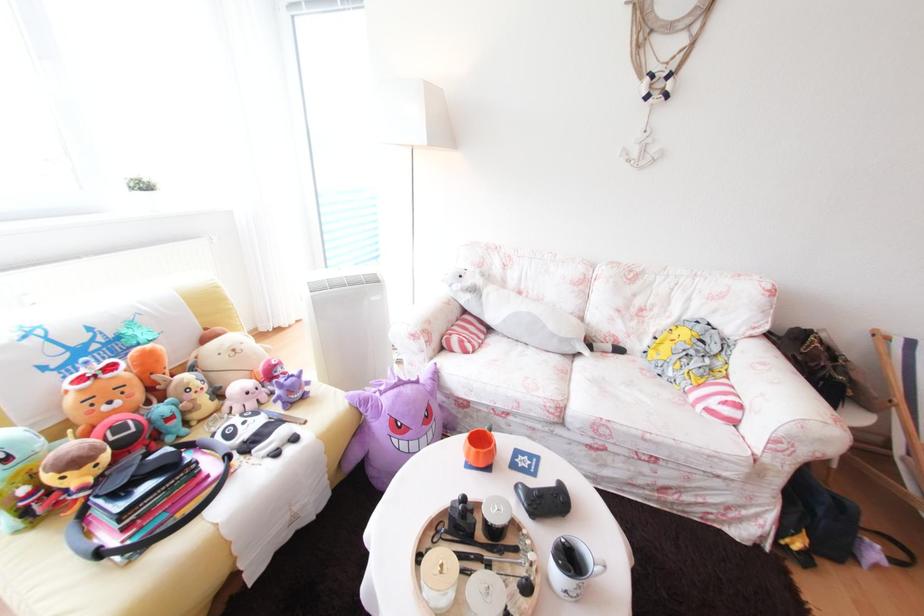
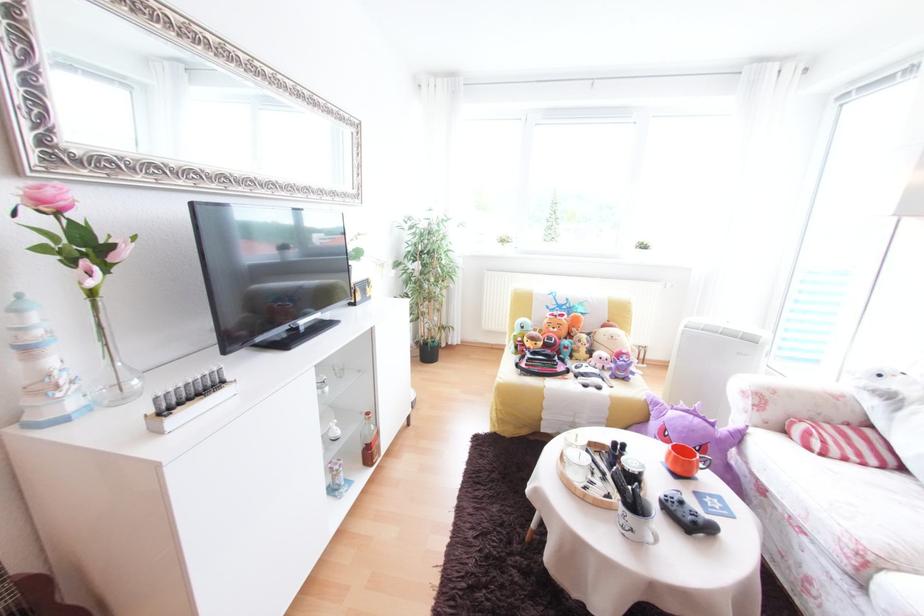
Locate, in the second image, the point that corresponds to (x=453, y=304) in the first image.

(834, 392)